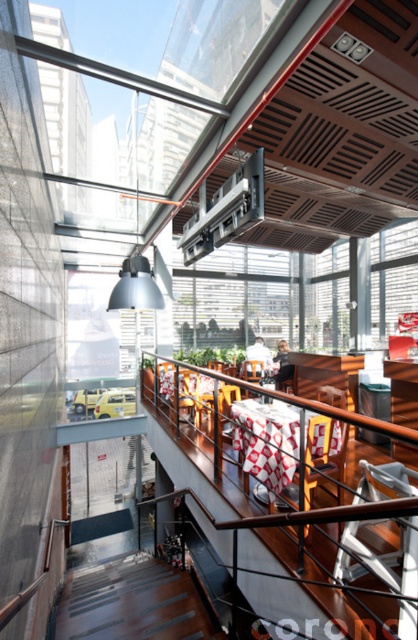
You are a customer entering the restaurant and need to locate the stairs. Given that both the dark wood stairs at lower center and the smooth concrete floor at lower center are visible from your entrance point, which object would you look for first to find the stairs?

The dark wood stairs at lower center has a larger size compared to the smooth concrete floor at lower center, so you should look for the larger object to find the stairs.

You are standing at the entrance of the modern restaurant or cafe and want to go down to the street level. Where should you go to find the dark wood stairs at lower center?

The dark wood stairs at lower center are located at the lower center of the scene, so you should head towards the central area near the lower part of the space to find them.

You are standing at the entrance of the modern restaurant or cafe and notice two points marked on the floor. The first point is at coordinate point (405, 536) and the second is at point (99, 528). If you were to walk towards the glass windows to enjoy the view, which point would you pass over first?

Point (405, 536) is in front of point (99, 528), so you would pass over point (405, 536) first as you walk towards the glass windows.